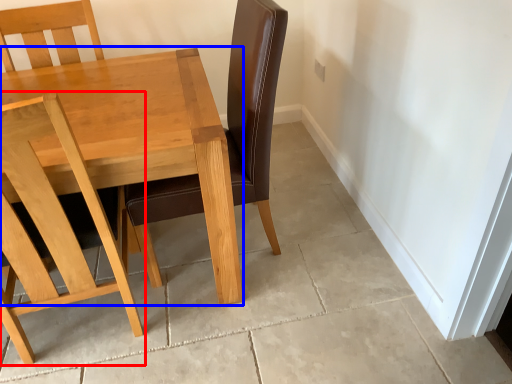
Question: Among these objects, which one is farthest to the camera, chair (highlighted by a red box) or table (highlighted by a blue box)?

Choices:
 (A) chair
 (B) table

Answer: (B)